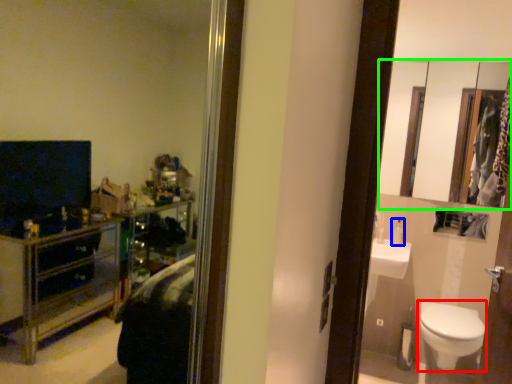
Question: Estimate the real-world distances between objects in this image. Which object is farther from toilet (highlighted by a red box), toiletry (highlighted by a blue box) or mirror (highlighted by a green box)?

Choices:
 (A) toiletry
 (B) mirror

Answer: (B)